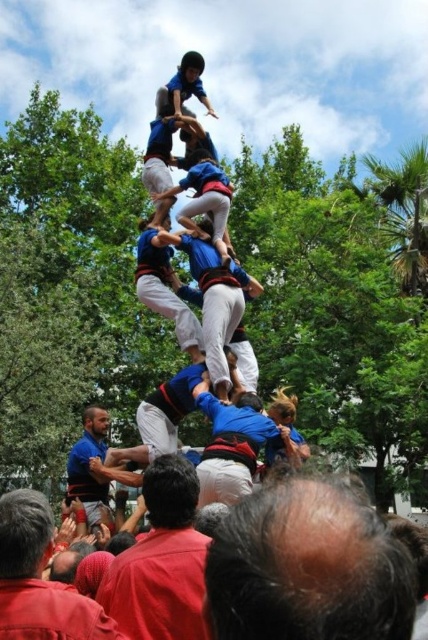
Question: Does bald head at center have a smaller size compared to red shirt at lower left?

Choices:
 (A) yes
 (B) no

Answer: (B)

Question: Which of the following is the farthest from the observer?

Choices:
 (A) red shirt at lower left
 (B) bald head at center
 (C) dark blue shirt at center

Answer: (A)

Question: Can you confirm if red shirt at lower left is bigger than blue shirt at center?

Choices:
 (A) yes
 (B) no

Answer: (B)

Question: Which is nearer to the bald head at center?

Choices:
 (A) blue shirt at center
 (B) dark blue shirt at center
 (C) red shirt at lower left

Answer: (B)

Question: Estimate the real-world distances between objects in this image. Which object is farther from the red shirt at lower left?

Choices:
 (A) dark blue shirt at center
 (B) bald head at center
 (C) blue shirt at center

Answer: (C)

Question: Is dark blue shirt at center wider than blue shirt at center?

Choices:
 (A) no
 (B) yes

Answer: (A)